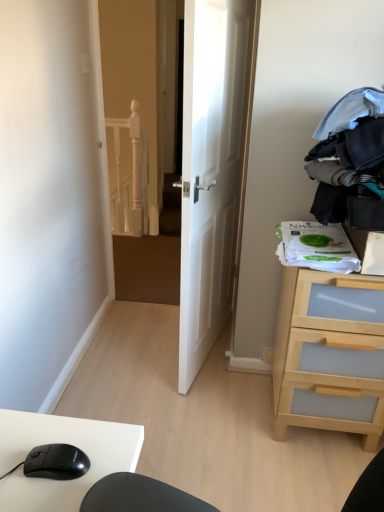
This screenshot has width=384, height=512. What are the coordinates of `vacant area that is in front of white glossy door at center` in the screenshot? It's located at (224, 413).